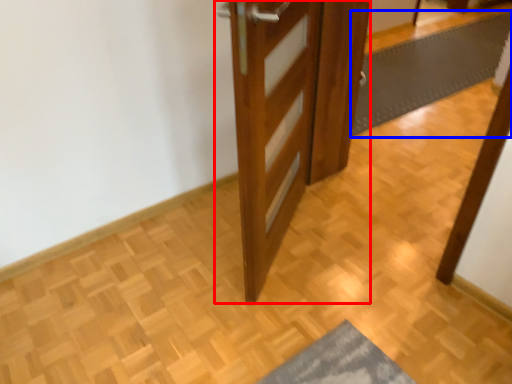
Question: Which point is further to the camera, door (highlighted by a red box) or bath mat (highlighted by a blue box)?

Choices:
 (A) door
 (B) bath mat

Answer: (B)